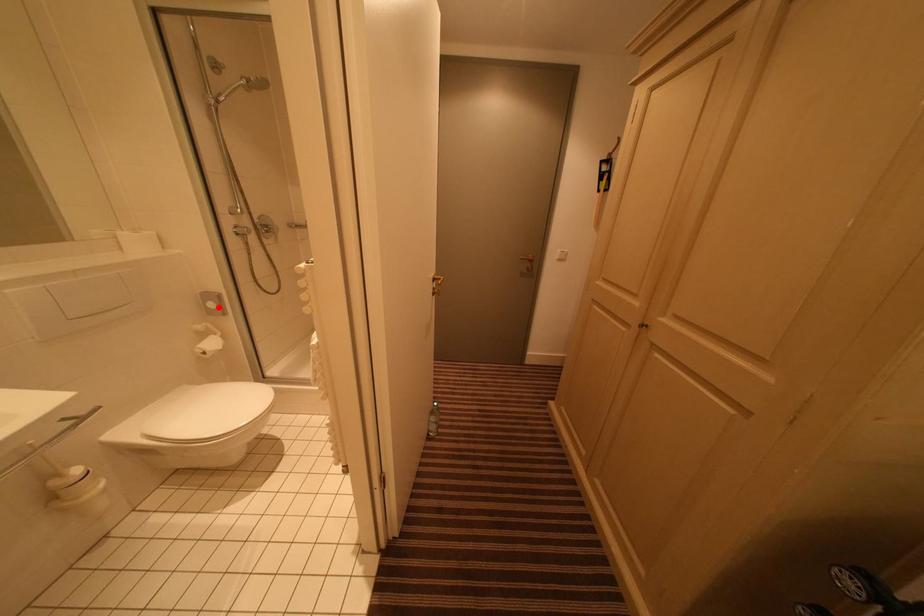
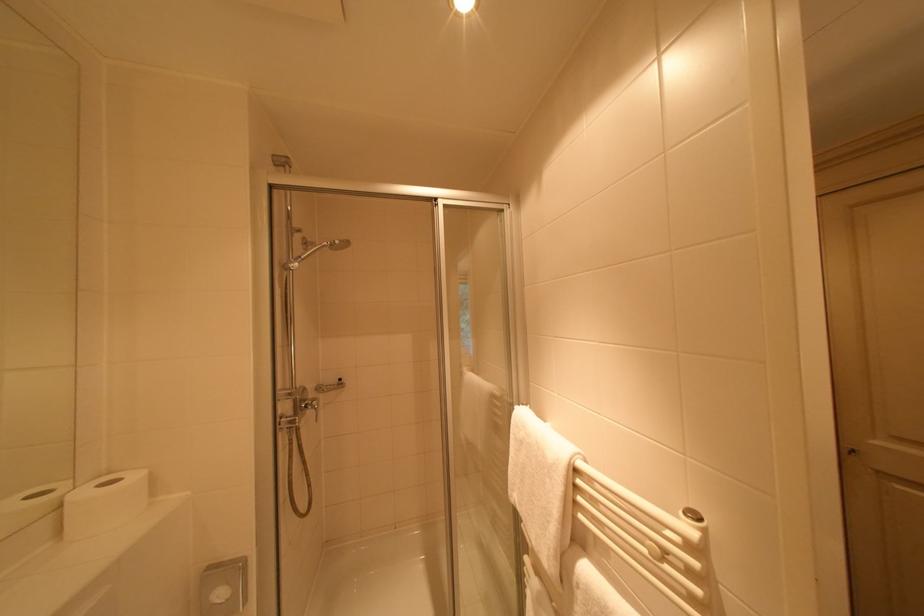
Question: I am providing you with two images of the same scene from different viewpoints. Given a red point in image1, look at the same physical point in image2. Is it:

Choices:
 (A) Closer to the viewpoint
 (B) Farther from the viewpoint

Answer: (A)